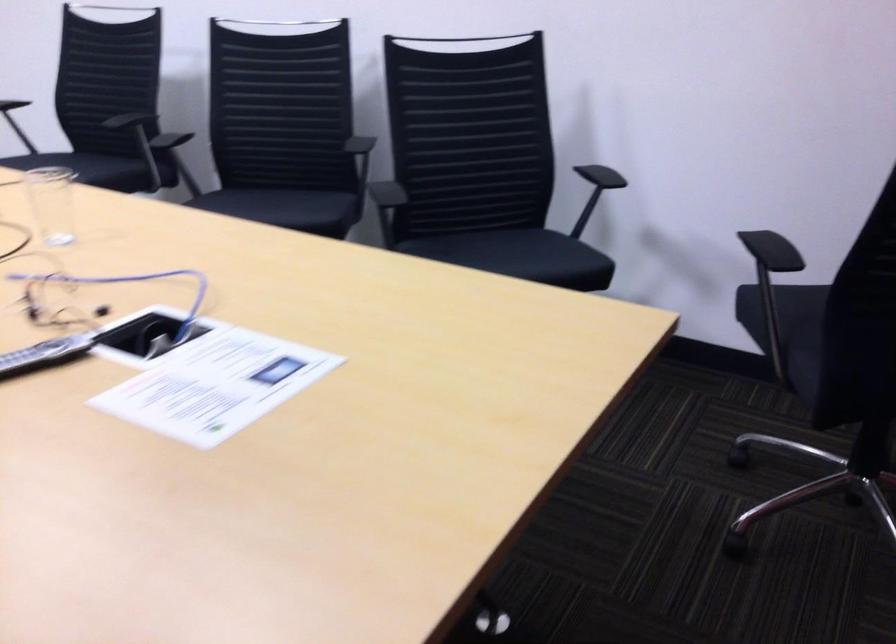
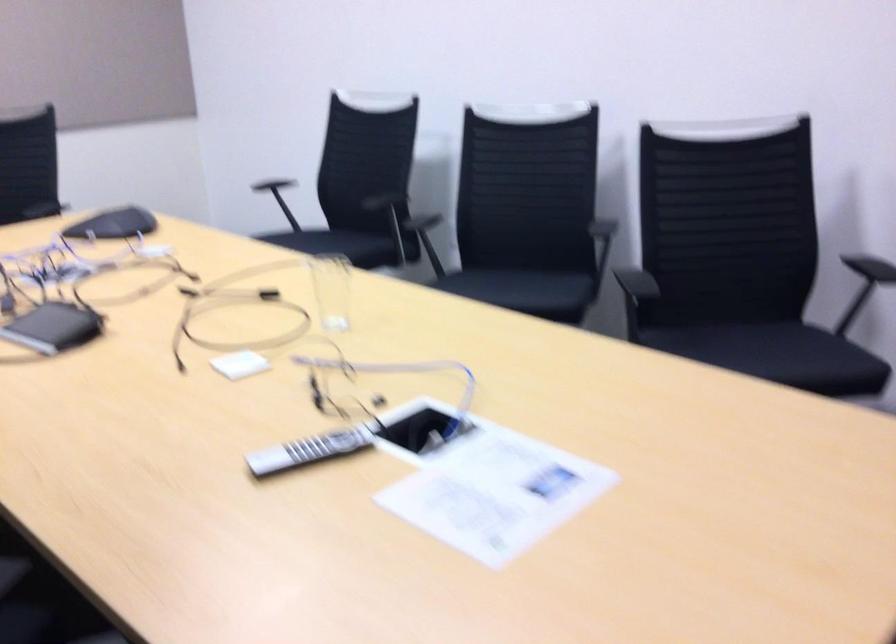
Where in the second image is the point corresponding to (x=518, y=254) from the first image?

(778, 355)